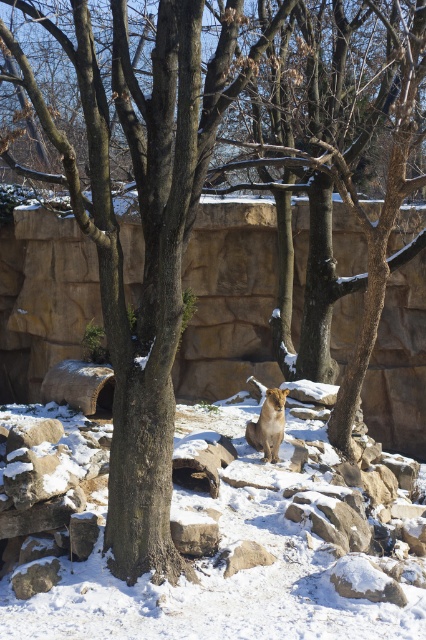
You are a zookeeper planning to clear the snow from the lioness enclosure. Which area should you prioritize first, the white powdery snow at center or the gray rough rock at lower right, and why?

You should prioritize clearing the white powdery snow at center first because it occupies less space than the gray rough rock at lower right, making it easier to manage initially.

You are a zookeeper planning to place a new feeding tray for the lioness. The tray requires a stable surface. Based on the scene, which object between the white powdery snow at center and the gray rough stone at lower center would you choose and why?

The gray rough stone at lower center is a better choice because it provides a stable surface compared to the white powdery snow at center, which is soft and may not support the feeding tray properly.